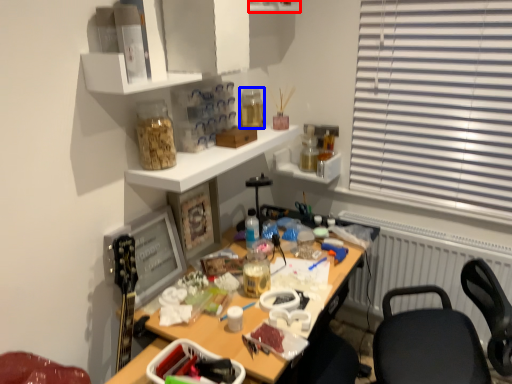
Question: Which object is further to the camera taking this photo, shelf (highlighted by a red box) or bottle (highlighted by a blue box)?

Choices:
 (A) shelf
 (B) bottle

Answer: (B)